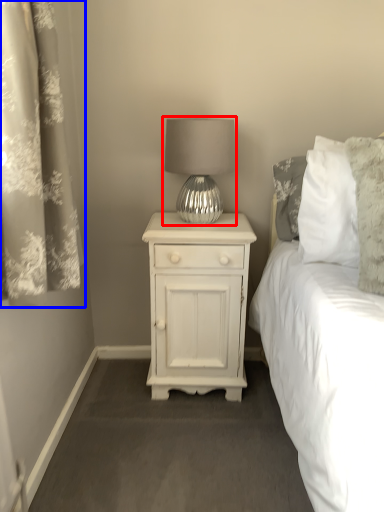
Question: Among these objects, which one is farthest to the camera, lamp (highlighted by a red box) or curtain (highlighted by a blue box)?

Choices:
 (A) lamp
 (B) curtain

Answer: (A)